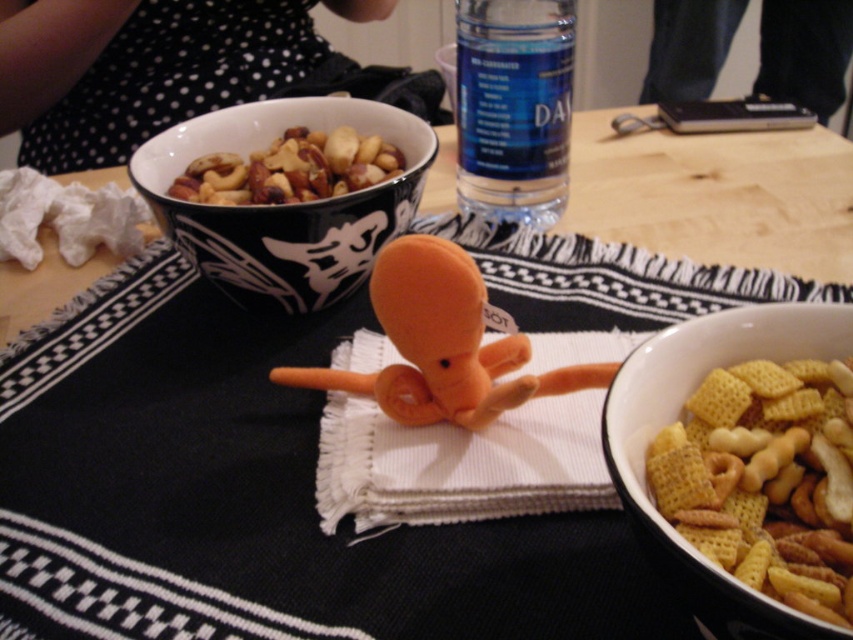
Based on the photo, you are setting up a table for a small gathering. You have a white woven cloth at center and shiny brown nuts at upper center. Which item takes up more space on the table?

The white woven cloth at center is bigger than the shiny brown nuts at upper center, so it takes up more space on the table.

You are a guest at a dinner party and see the white woven cloth at center and the orange plush octopus at center on the table. Which object is directly underneath the other?

The white woven cloth at center is positioned under the orange plush octopus at center, so the cloth is directly underneath the octopus.

You are standing 12 inches away from the dining table. There is a point at coordinates point (415, 524). Can you reach that point without moving closer to the table?

The distance of point (415, 524) from viewer is 10.57 inches, so yes, you can reach it since you are standing 12 inches away which is farther than the point.